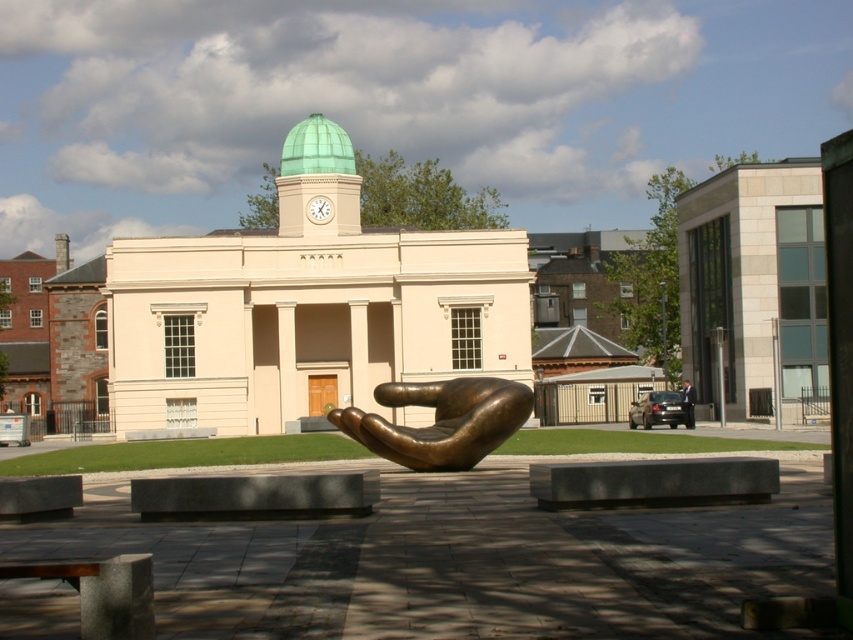
Question: Among these points, which one is nearest to the camera?

Choices:
 (A) (686, 404)
 (B) (383, 397)

Answer: (B)

Question: Can you confirm if bronze hand at center is positioned to the right of dark suit at center?

Choices:
 (A) no
 (B) yes

Answer: (A)

Question: Can you confirm if bronze hand at center is smaller than dark suit at center?

Choices:
 (A) yes
 (B) no

Answer: (A)

Question: Can you confirm if bronze hand at center is positioned to the right of dark suit at center?

Choices:
 (A) no
 (B) yes

Answer: (A)

Question: Which of the following is the farthest from the observer?

Choices:
 (A) dark suit at center
 (B) bronze hand at center

Answer: (A)